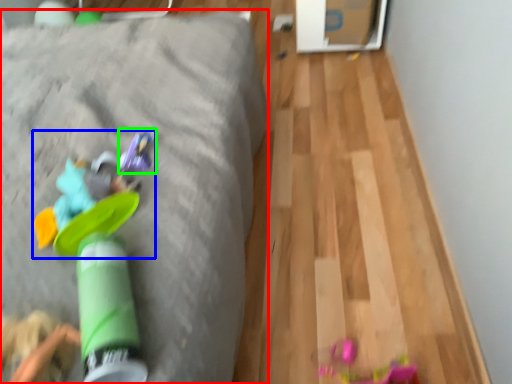
Question: Which is farther away from furniture (highlighted by a red box)? toy (highlighted by a blue box) or toy (highlighted by a green box)?

Choices:
 (A) toy
 (B) toy

Answer: (B)